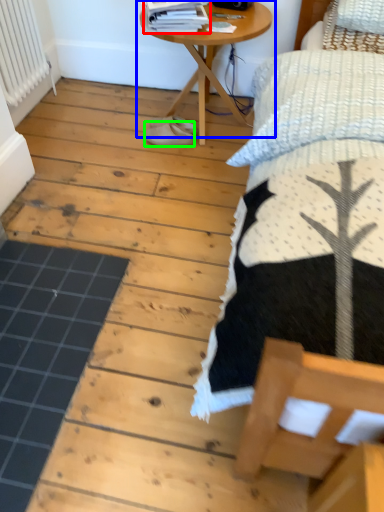
Question: Estimate the real-world distances between objects in this image. Which object is closer to magazine (highlighted by a red box), table (highlighted by a blue box) or footwear (highlighted by a green box)?

Choices:
 (A) table
 (B) footwear

Answer: (A)